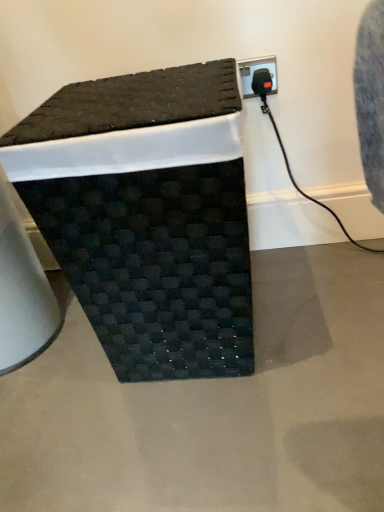
This screenshot has width=384, height=512. Describe the element at coordinates (147, 215) in the screenshot. I see `black woven basket at center` at that location.

Identify the location of black woven basket at center. click(147, 215).

Identify the location of black woven basket at center. (147, 215).